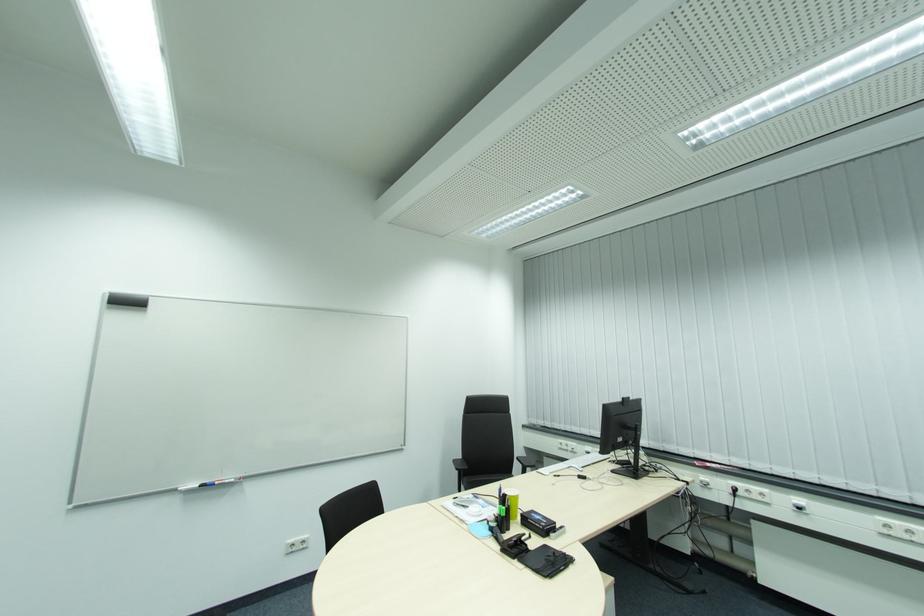
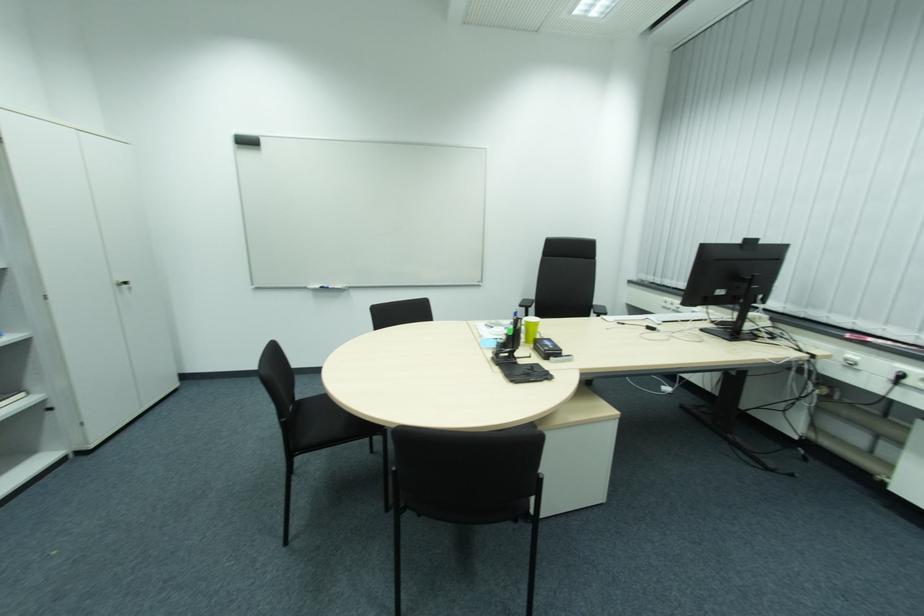
Locate, in the second image, the point that corresponds to (574,468) in the first image.

(650, 321)